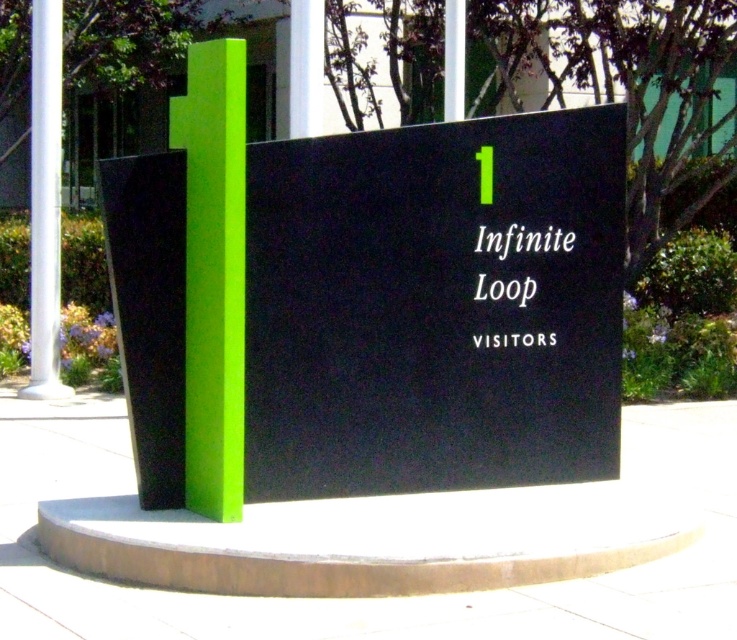
You are a visitor arriving at the entrance and need to locate the sign. From your perspective, which object is bigger between the matte black sign at center and the white smooth pole at left?

The matte black sign at center is larger in size compared to the white smooth pole at left.

You are standing in front of the signboard at the entrance. There is a point marked at coordinates point (642, 616) on the signboard. If you want to touch this point with a stick that is 4 meters long, will the stick be long enough?

The distance of point (642, 616) from viewer is 4.62 meters. Since the stick is only 4 meters long, it is not long enough to reach the point.